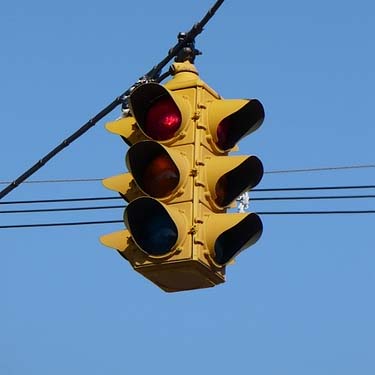
Image resolution: width=375 pixels, height=375 pixels. In order to click on bracket in this screenshot , I will do `click(145, 76)`.